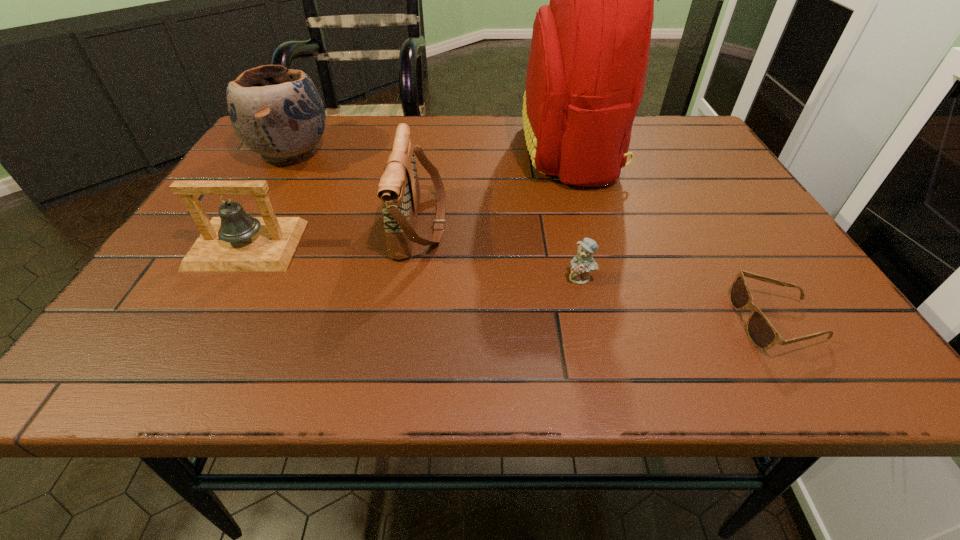
Point out which object is positioned as the fourth nearest to the pottery. Please provide its 2D coordinates. Your answer should be formatted as a tuple, i.e. [(x, y)], where the tuple contains the x and y coordinates of a point satisfying the conditions above.

[(583, 263)]

Find the location of a particular element. This screenshot has width=960, height=540. vacant space that satisfies the following two spatial constraints: 1. on the front side of the pottery; 2. on the left side of the bell is located at coordinates (236, 245).

Identify the location of vacant area in the image that satisfies the following two spatial constraints: 1. on the front-facing side of the backpack; 2. on the front-facing side of the teddy bear. This screenshot has width=960, height=540. (607, 278).